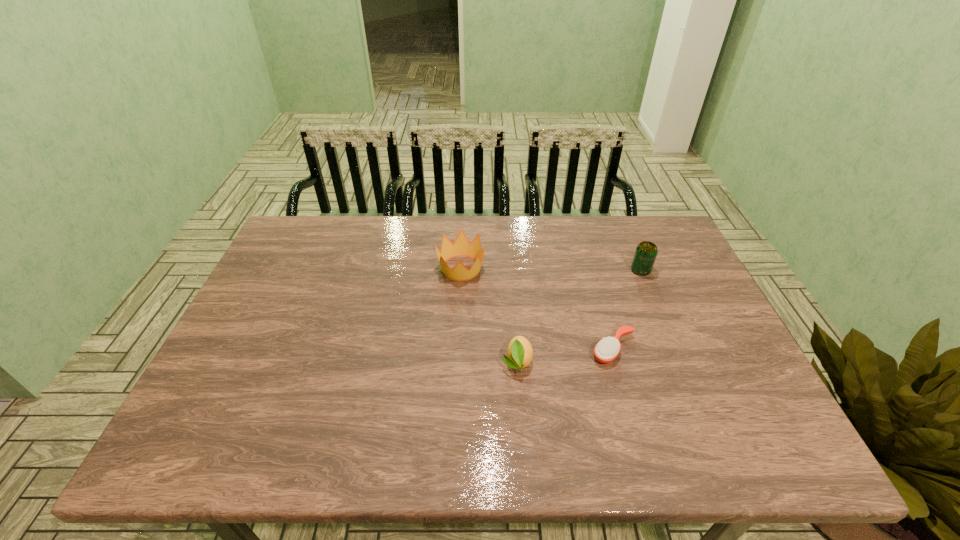
Where is `crown`? The height and width of the screenshot is (540, 960). crown is located at coordinates (461, 247).

Identify the location of beer can. The width and height of the screenshot is (960, 540). (646, 252).

Find the location of a particular element. The width and height of the screenshot is (960, 540). the third object from right to left is located at coordinates (519, 353).

The image size is (960, 540). Find the location of `the second shortest object`. the second shortest object is located at coordinates (519, 353).

Where is `the third object from left to right`? This screenshot has width=960, height=540. the third object from left to right is located at coordinates (606, 350).

You are a GUI agent. You are given a task and a screenshot of the screen. Output one action in this format:
    pyautogui.click(x=<x>, y=<y>)
    Task: Click on the shortest object
    
    Given the screenshot: What is the action you would take?
    pyautogui.click(x=606, y=350)

Identify the location of free space located on the right of the leftmost object. (536, 268).

The width and height of the screenshot is (960, 540). Find the location of `vacant area situated on the right of the beer can`. vacant area situated on the right of the beer can is located at coordinates (670, 271).

This screenshot has height=540, width=960. Find the location of `vacant space located with leaves positioned above the second shortest object`. vacant space located with leaves positioned above the second shortest object is located at coordinates (524, 448).

Find the location of `vacant space located on the left of the shortest object`. vacant space located on the left of the shortest object is located at coordinates (542, 349).